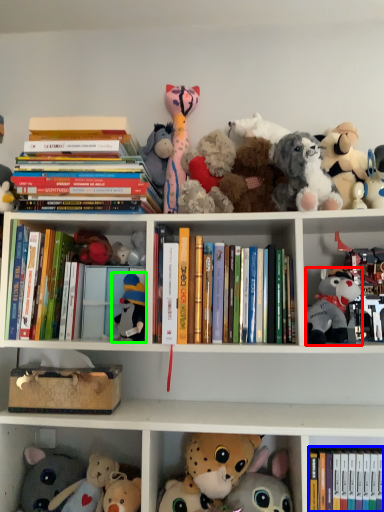
Question: Which is farther away from toy (highlighted by a red box)? book (highlighted by a blue box) or toy (highlighted by a green box)?

Choices:
 (A) book
 (B) toy

Answer: (B)